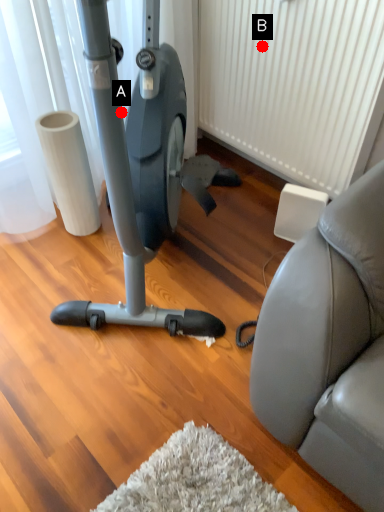
Question: Two points are circled on the image, labeled by A and B beside each circle. Among these points, which one is farthest from the camera?

Choices:
 (A) A is further
 (B) B is further

Answer: (B)